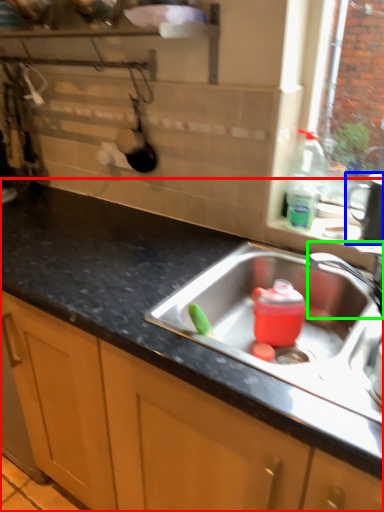
Question: Which is farther away from countertop (highlighted by a red box)? appliance (highlighted by a blue box) or tap (highlighted by a green box)?

Choices:
 (A) appliance
 (B) tap

Answer: (A)